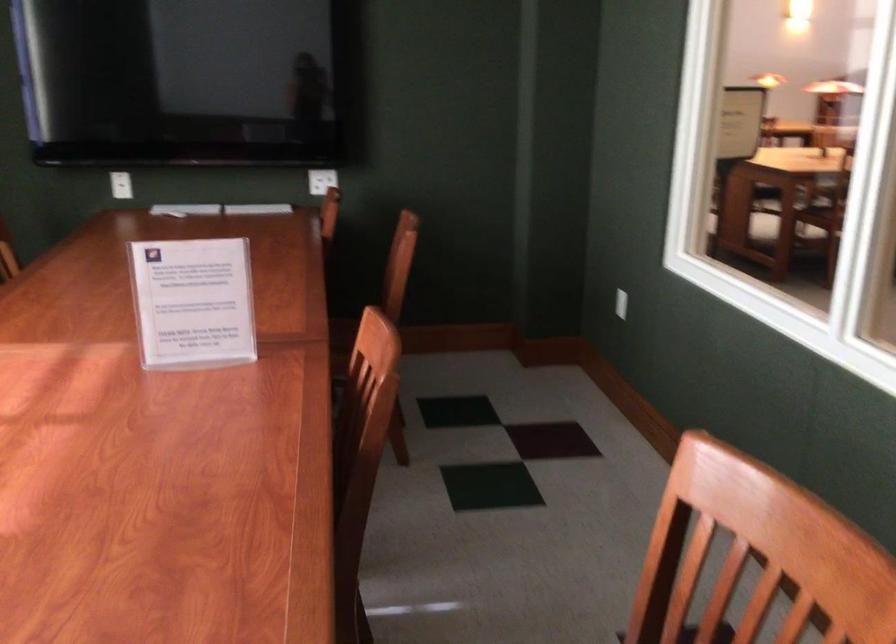
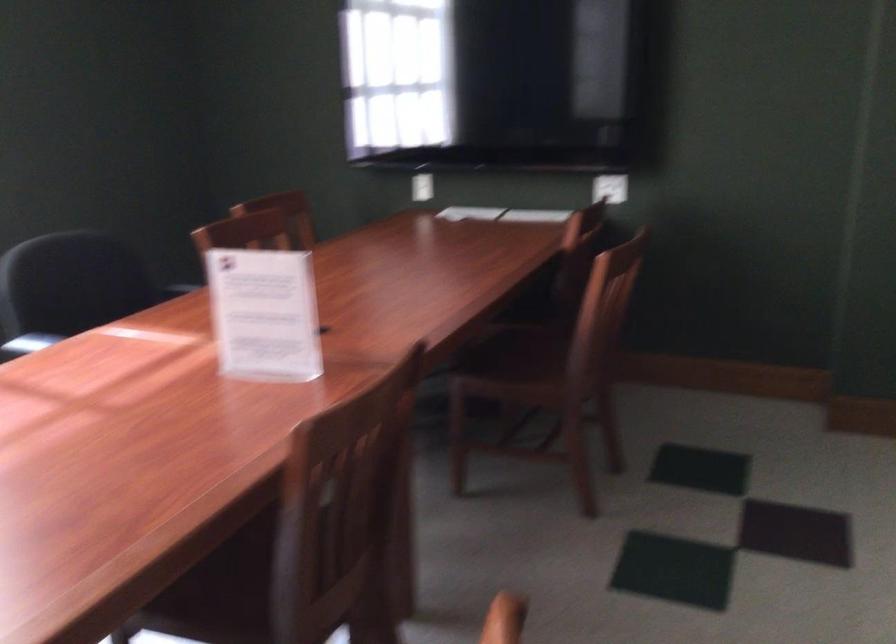
Question: How did the camera likely rotate?

Choices:
 (A) Left
 (B) Right
 (C) Up
 (D) Down

Answer: (A)